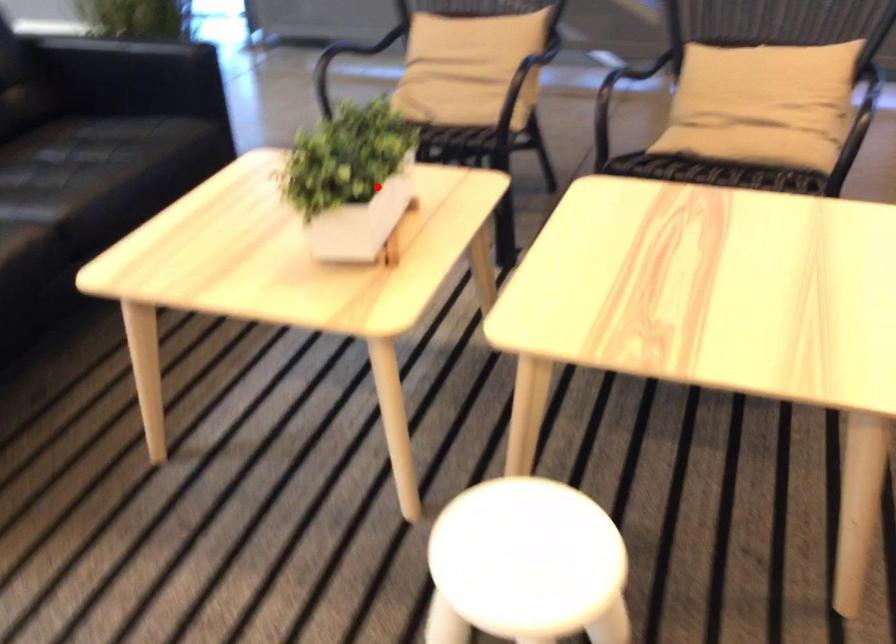
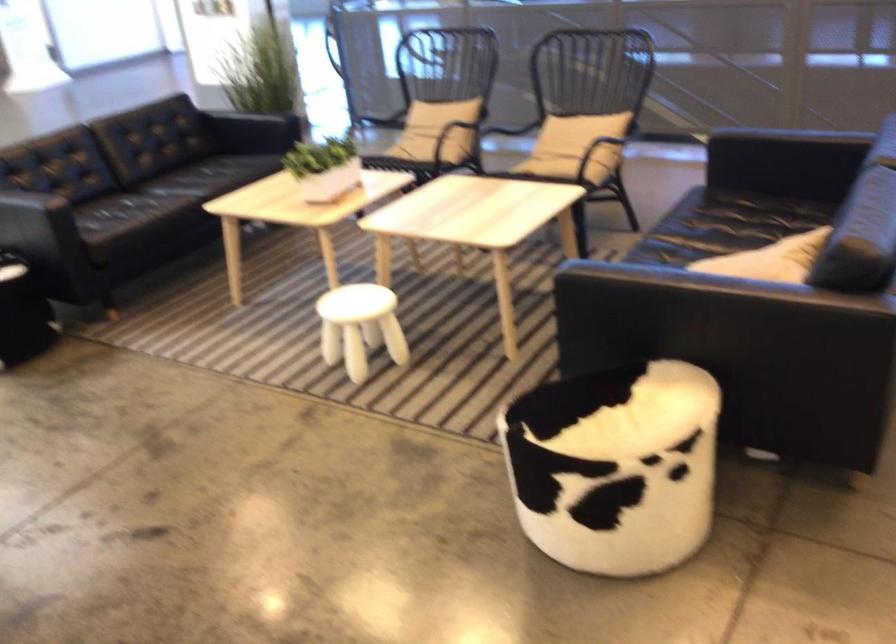
Question: I am providing you with two images of the same scene from different viewpoints. In image1, a red point is highlighted. Considering the same 3D point in image2, which of the following is correct?

Choices:
 (A) It is closer
 (B) It is farther

Answer: (B)